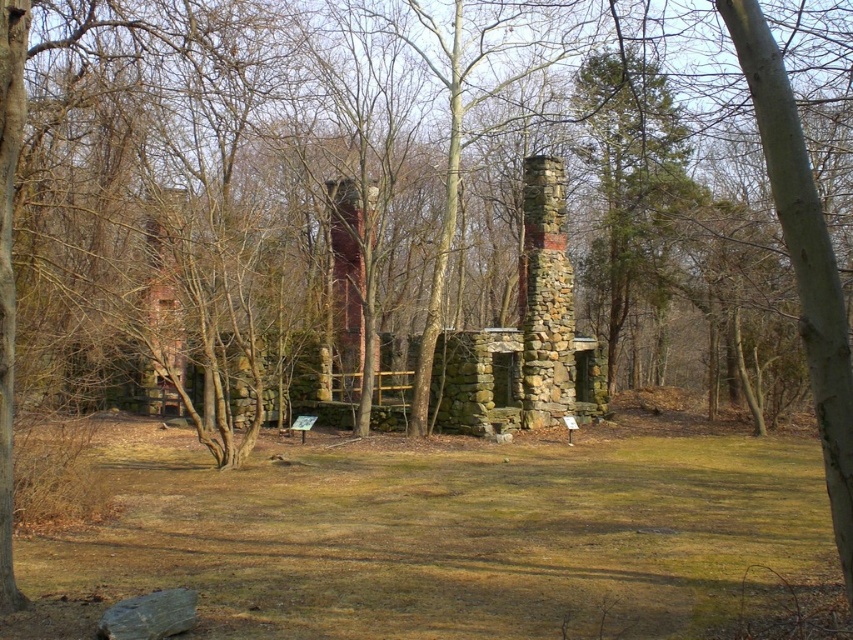
You are a photographer planning to take a photo of the stone chimney at center and the red brick chimney at center. Since both are in the center, how can you position yourself to ensure both chimneys are clearly visible in the frame?

The stone chimney at center is in front of the red brick chimney at center. To ensure both are visible, position yourself so that you can see around or above the stone chimney at center to capture the red brick chimney at center behind it.

Consider the image. You are a hiker who wants to take a clear photo of the red brick chimney at center without any obstructions. Considering the green grass at center, will the grass block your view of the chimney?

The green grass at center has a lesser height compared to red brick chimney at center, so the grass will not block your view of the chimney.

You are a drone operator trying to land a drone on the green grass at center. According to the coordinates provided, where exactly should you aim the drone to land?

The green grass at center is located at the 2D coordinates point (440, 536), so you should aim the drone to land there.